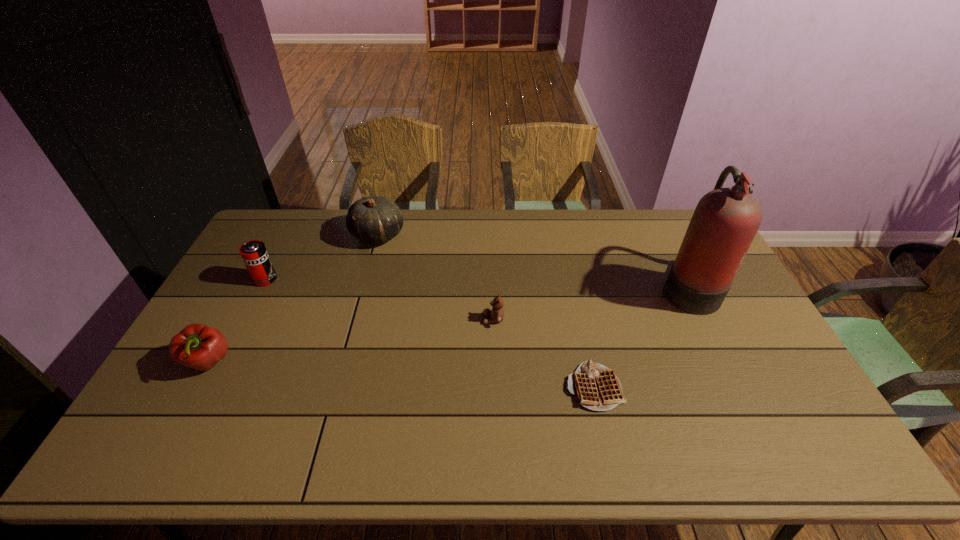
This screenshot has width=960, height=540. I want to click on object that is the fourth nearest to the bell pepper, so click(x=596, y=387).

Find the location of a particular element. the third closest object to the bell pepper is located at coordinates (496, 314).

At what (x,y) coordinates should I click in order to perform the action: click on free space that satisfies the following two spatial constraints: 1. on the back side of the can; 2. on the right side of the bell pepper. Please return your answer as a coordinate pair (x, y). This screenshot has height=540, width=960. Looking at the image, I should click on (253, 279).

Locate an element on the screen. This screenshot has height=540, width=960. free location that satisfies the following two spatial constraints: 1. on the front side of the shortest object; 2. on the left side of the can is located at coordinates (210, 387).

Locate an element on the screen. The width and height of the screenshot is (960, 540). free location that satisfies the following two spatial constraints: 1. on the front-facing side of the teddy bear; 2. on the front side of the bell pepper is located at coordinates (494, 362).

Identify the location of free location that satisfies the following two spatial constraints: 1. on the front side of the farthest object; 2. on the left side of the fifth object from left to right. Image resolution: width=960 pixels, height=540 pixels. (336, 387).